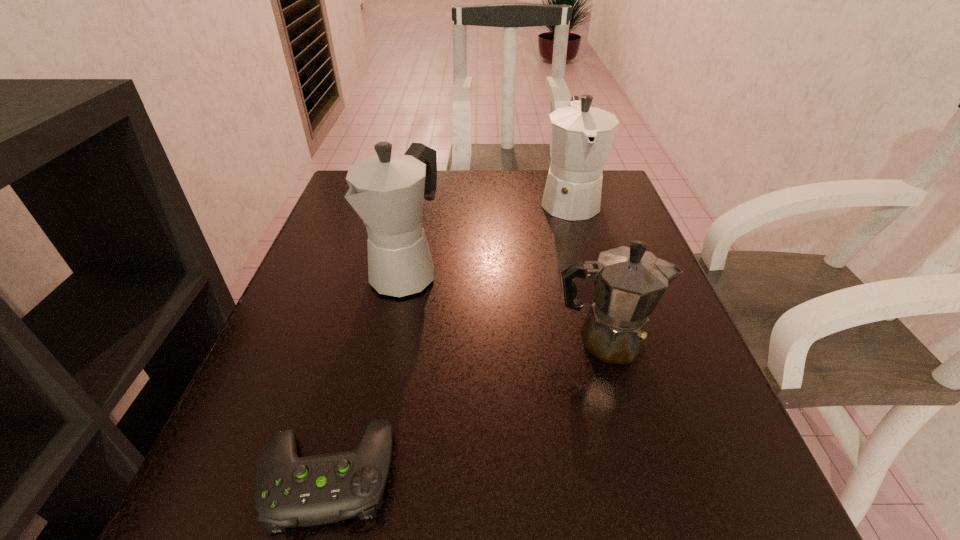
The height and width of the screenshot is (540, 960). Identify the location of the second closest object to the shortest object. (x=628, y=281).

The height and width of the screenshot is (540, 960). What are the coordinates of `coffeepot that is the closest to the shortest coffeepot` in the screenshot? It's located at (387, 190).

Where is `the third closest coffeepot to the control`? the third closest coffeepot to the control is located at coordinates (581, 136).

You are a GUI agent. You are given a task and a screenshot of the screen. Output one action in this format:
    pyautogui.click(x=<x>, y=<y>)
    Task: Click on the vacant space that satisfies the following two spatial constraints: 1. at the spout of the farthest object; 2. on the pouring side of the shortest coffeepot
    This screenshot has height=540, width=960.
    Given the screenshot: What is the action you would take?
    pyautogui.click(x=610, y=339)